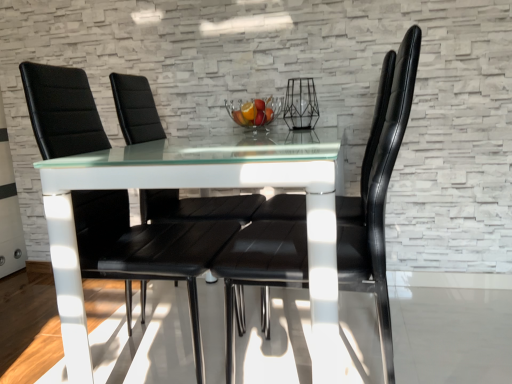
Question: From a real-world perspective, is clear glass bowl at center positioned over black leather chair at center, which is counted as the first chair, starting from the back, based on gravity?

Choices:
 (A) no
 (B) yes

Answer: (B)

Question: From the image's perspective, is clear glass bowl at center above black leather chair at center, which is counted as the first chair, starting from the back?

Choices:
 (A) no
 (B) yes

Answer: (B)

Question: Does clear glass bowl at center have a greater height compared to black leather chair at center, marked as the 3th chair in a front-to-back arrangement?

Choices:
 (A) yes
 (B) no

Answer: (B)

Question: Is clear glass bowl at center smaller than black leather chair at center, marked as the 3th chair in a front-to-back arrangement?

Choices:
 (A) no
 (B) yes

Answer: (B)

Question: Can you confirm if clear glass bowl at center is shorter than black leather chair at center, marked as the 3th chair in a front-to-back arrangement?

Choices:
 (A) no
 (B) yes

Answer: (B)

Question: From the image's perspective, is black leather chair at center, placed as the second chair when sorted from back to front, above or below clear glass bowl at center?

Choices:
 (A) above
 (B) below

Answer: (B)

Question: Is black leather chair at center, the second chair when ordered from front to back, spatially inside clear glass bowl at center, or outside of it?

Choices:
 (A) outside
 (B) inside

Answer: (A)

Question: Considering the positions of point (189, 306) and point (261, 110), is point (189, 306) closer or farther from the camera than point (261, 110)?

Choices:
 (A) farther
 (B) closer

Answer: (A)

Question: Visually, is black leather chair at center, placed as the second chair when sorted from back to front, positioned to the left or to the right of clear glass bowl at center?

Choices:
 (A) left
 (B) right

Answer: (A)

Question: From a real-world perspective, is black leather chair at center, which is counted as the first chair, starting from the back, positioned above or below black leather chair at center, the second chair when ordered from front to back?

Choices:
 (A) above
 (B) below

Answer: (B)

Question: Do you think black leather chair at center, which is counted as the first chair, starting from the back, is within black leather chair at center, the second chair when ordered from front to back, or outside of it?

Choices:
 (A) outside
 (B) inside

Answer: (A)

Question: From the image's perspective, is black leather chair at center, which is counted as the first chair, starting from the back, above or below black leather chair at center, the second chair when ordered from front to back?

Choices:
 (A) below
 (B) above

Answer: (B)

Question: Would you say black leather chair at center, marked as the 3th chair in a front-to-back arrangement, is to the left or to the right of black leather chair at center, placed as the second chair when sorted from back to front, in the picture?

Choices:
 (A) left
 (B) right

Answer: (B)

Question: Is black leather chair at center, which is the 1th chair in front-to-back order, inside the boundaries of black leather chair at center, marked as the 3th chair in a front-to-back arrangement, or outside?

Choices:
 (A) inside
 (B) outside

Answer: (B)

Question: Looking at their shapes, would you say black leather chair at center, which is the 1th chair in front-to-back order, is wider or thinner than black leather chair at center, marked as the 3th chair in a front-to-back arrangement?

Choices:
 (A) wide
 (B) thin

Answer: (A)